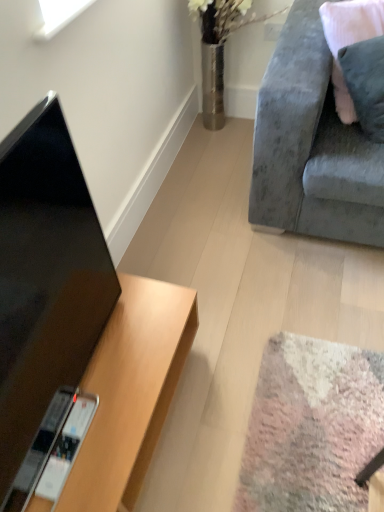
This screenshot has height=512, width=384. Find the location of `velvet pink pillow at upper right`. velvet pink pillow at upper right is located at coordinates (349, 41).

What do you see at coordinates (349, 41) in the screenshot? I see `velvet pink pillow at upper right` at bounding box center [349, 41].

Image resolution: width=384 pixels, height=512 pixels. Describe the element at coordinates (45, 288) in the screenshot. I see `black glossy tv at left` at that location.

The image size is (384, 512). Describe the element at coordinates (131, 391) in the screenshot. I see `wooden desk at lower left` at that location.

Locate an element on the screen. This screenshot has width=384, height=512. velvet grey couch at upper right is located at coordinates (312, 145).

Is wooden desk at lower left a part of velvet pink pillow at upper right?

No, wooden desk at lower left is located outside of velvet pink pillow at upper right.

Where is `pillow above the wooden desk at lower left (from the image's perspective)`? The height and width of the screenshot is (512, 384). pillow above the wooden desk at lower left (from the image's perspective) is located at coordinates (349, 41).

Considering the sizes of velvet pink pillow at upper right and wooden desk at lower left in the image, is velvet pink pillow at upper right wider or thinner than wooden desk at lower left?

Considering their sizes, velvet pink pillow at upper right looks slimmer than wooden desk at lower left.

Is velvet grey couch at upper right at the right side of velvet pink pillow at upper right?

In fact, velvet grey couch at upper right is to the left of velvet pink pillow at upper right.

Relative to velvet pink pillow at upper right, is velvet grey couch at upper right in front or behind?

In the image, velvet grey couch at upper right appears in front of velvet pink pillow at upper right.

Is velvet pink pillow at upper right a part of velvet grey couch at upper right?

Absolutely, velvet pink pillow at upper right is inside velvet grey couch at upper right.

Does black glossy tv at left touch wooden desk at lower left?

black glossy tv at left and wooden desk at lower left are not in contact.

Consider the image. From a real-world perspective, does black glossy tv at left stand above wooden desk at lower left?

Yes, from a real-world perspective, black glossy tv at left is above wooden desk at lower left.

Identify the location of television lying above the wooden desk at lower left (from the image's perspective). This screenshot has width=384, height=512. (45, 288).

Is velvet pink pillow at upper right positioned in front of velvet grey couch at upper right?

No, the depth of velvet pink pillow at upper right is greater than that of velvet grey couch at upper right.

Considering the sizes of objects velvet pink pillow at upper right and velvet grey couch at upper right in the image provided, who is shorter, velvet pink pillow at upper right or velvet grey couch at upper right?

Standing shorter between the two is velvet pink pillow at upper right.

From the picture: How distant is velvet pink pillow at upper right from velvet grey couch at upper right?

velvet pink pillow at upper right is 20.92 centimeters away from velvet grey couch at upper right.

Based on the photo, does velvet pink pillow at upper right have a greater width compared to velvet grey couch at upper right?

No, velvet pink pillow at upper right is not wider than velvet grey couch at upper right.

Could you tell me if velvet grey couch at upper right is facing black glossy tv at left?

Yes, velvet grey couch at upper right is oriented towards black glossy tv at left.

Is velvet grey couch at upper right not inside black glossy tv at left?

Yes.

Image resolution: width=384 pixels, height=512 pixels. Identify the location of television on the left of velvet grey couch at upper right. (45, 288).

Is velvet grey couch at upper right bigger than black glossy tv at left?

Correct, velvet grey couch at upper right is larger in size than black glossy tv at left.

Choose the correct answer: Is wooden desk at lower left inside black glossy tv at left or outside it?

wooden desk at lower left exists outside the volume of black glossy tv at left.

Considering the sizes of objects wooden desk at lower left and black glossy tv at left in the image provided, who is bigger, wooden desk at lower left or black glossy tv at left?

With larger size is wooden desk at lower left.

From the image's perspective, which object appears higher, wooden desk at lower left or black glossy tv at left?

black glossy tv at left.

Is black glossy tv at left located within velvet pink pillow at upper right?

No, velvet pink pillow at upper right does not contain black glossy tv at left.

Which object is positioned more to the right, velvet pink pillow at upper right or black glossy tv at left?

velvet pink pillow at upper right is more to the right.

Is point (358, 29) closer to viewer compared to point (56, 181)?

No, it is not.

Are velvet pink pillow at upper right and black glossy tv at left beside each other?

There is a gap between velvet pink pillow at upper right and black glossy tv at left.

Image resolution: width=384 pixels, height=512 pixels. What are the coordinates of `desk below the velvet pink pillow at upper right (from the image's perspective)` in the screenshot? It's located at (131, 391).

Identify the location of pillow behind the velvet grey couch at upper right. The height and width of the screenshot is (512, 384). (349, 41).

Considering their positions, is black glossy tv at left positioned further to velvet pink pillow at upper right than wooden desk at lower left?

Among the two, black glossy tv at left is located further to velvet pink pillow at upper right.

Based on their spatial positions, is wooden desk at lower left or black glossy tv at left further from velvet grey couch at upper right?

Based on the image, black glossy tv at left appears to be further to velvet grey couch at upper right.

Based on their spatial positions, is velvet pink pillow at upper right or velvet grey couch at upper right further from black glossy tv at left?

velvet pink pillow at upper right is positioned further to the anchor black glossy tv at left.

From the image, which object appears to be farther from velvet grey couch at upper right, wooden desk at lower left or velvet pink pillow at upper right?

wooden desk at lower left is further to velvet grey couch at upper right.

Looking at the image, which one is located further to wooden desk at lower left, black glossy tv at left or velvet pink pillow at upper right?

velvet pink pillow at upper right lies further to wooden desk at lower left than the other object.

When comparing their distances from velvet pink pillow at upper right, does wooden desk at lower left or black glossy tv at left seem further?

black glossy tv at left is further to velvet pink pillow at upper right.

Considering their positions, is velvet grey couch at upper right positioned further to wooden desk at lower left than black glossy tv at left?

velvet grey couch at upper right is further to wooden desk at lower left.

Estimate the real-world distances between objects in this image. Which object is further from velvet pink pillow at upper right, velvet grey couch at upper right or black glossy tv at left?

A: black glossy tv at left.

The height and width of the screenshot is (512, 384). In order to click on studio couch between black glossy tv at left and velvet pink pillow at upper right in the horizontal direction in this screenshot , I will do `click(312, 145)`.

This screenshot has height=512, width=384. I want to click on desk between black glossy tv at left and velvet pink pillow at upper right from left to right, so click(131, 391).

Where is `pillow that lies between velvet grey couch at upper right and wooden desk at lower left from top to bottom`? The height and width of the screenshot is (512, 384). pillow that lies between velvet grey couch at upper right and wooden desk at lower left from top to bottom is located at coordinates (349, 41).

This screenshot has width=384, height=512. I want to click on television between velvet grey couch at upper right and wooden desk at lower left from top to bottom, so click(x=45, y=288).